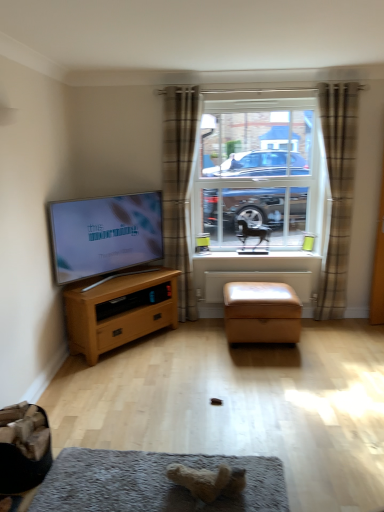
Where is `clear glass window at center`? The image size is (384, 512). clear glass window at center is located at coordinates (260, 170).

The image size is (384, 512). Find the location of `white painted wood at center`. white painted wood at center is located at coordinates (252, 252).

Measure the distance between white painted wood at center and camera.

white painted wood at center and camera are 4.01 meters apart.

What do you see at coordinates (252, 231) in the screenshot?
I see `black glossy horse at center, marked as the 2th animal in a left-to-right arrangement` at bounding box center [252, 231].

Locate an element on the screen. This screenshot has width=384, height=512. black glossy horse at center, which appears as the 1th animal when viewed from the back is located at coordinates (252, 231).

This screenshot has height=512, width=384. What do you see at coordinates (208, 481) in the screenshot?
I see `fuzzy beige teddy bear at lower center, positioned as the first animal in front-to-back order` at bounding box center [208, 481].

This screenshot has width=384, height=512. What are the coordinates of `clear glass window at center` in the screenshot? It's located at (260, 170).

Is matte black tv at left oriented towards soft gray carpet at lower center?

No, matte black tv at left is not facing towards soft gray carpet at lower center.

Considering the relative sizes of matte black tv at left and soft gray carpet at lower center in the image provided, is matte black tv at left bigger than soft gray carpet at lower center?

Yes, matte black tv at left is bigger than soft gray carpet at lower center.

How different are the orientations of matte black tv at left and soft gray carpet at lower center in degrees?

141 degrees separate the facing orientations of matte black tv at left and soft gray carpet at lower center.

Is point (149, 204) closer or farther from the camera than point (273, 488)?

Point (149, 204).

Considering the relative positions of clear glass window at center and wooden chest of drawers at left in the image provided, is clear glass window at center in front of wooden chest of drawers at left?

No, clear glass window at center is further to the viewer.

Is point (200, 122) farther from camera compared to point (141, 317)?

That is True.

Is wooden chest of drawers at left at the back of clear glass window at center?

No.

The height and width of the screenshot is (512, 384). I want to click on chest of drawers on the left of clear glass window at center, so click(x=120, y=311).

From a real-world perspective, is satin tan ottoman at center above or below plaid fabric curtain at center, the first curtain viewed from the left?

satin tan ottoman at center is situated lower than plaid fabric curtain at center, the first curtain viewed from the left, in the real world.

How distant is satin tan ottoman at center from plaid fabric curtain at center, the first curtain viewed from the left?

satin tan ottoman at center and plaid fabric curtain at center, the first curtain viewed from the left, are 93.65 centimeters apart from each other.

What's the angular difference between satin tan ottoman at center and plaid fabric curtain at center, the 2th curtain when ordered from right to left,'s facing directions?

satin tan ottoman at center and plaid fabric curtain at center, the 2th curtain when ordered from right to left, are facing 0.305 degrees away from each other.

Can you confirm if satin tan ottoman at center is taller than plaid fabric curtain at center, the first curtain viewed from the left?

In fact, satin tan ottoman at center may be shorter than plaid fabric curtain at center, the first curtain viewed from the left.

Could you measure the distance between brown plaid curtain at right, the first curtain when ordered from right to left, and white painted wood at center?

brown plaid curtain at right, the first curtain when ordered from right to left, is 30.14 inches from white painted wood at center.

Considering the relative positions of brown plaid curtain at right, the first curtain when ordered from right to left, and white painted wood at center in the image provided, is brown plaid curtain at right, the first curtain when ordered from right to left, to the left or to the right of white painted wood at center?

In the image, brown plaid curtain at right, the first curtain when ordered from right to left, appears on the right side of white painted wood at center.

From the image's perspective, who appears lower, brown plaid curtain at right, which is the 2th curtain from left to right, or white painted wood at center?

white painted wood at center is shown below in the image.

Can you confirm if brown plaid curtain at right, which is the 2th curtain from left to right, is shorter than white painted wood at center?

Incorrect, the height of brown plaid curtain at right, which is the 2th curtain from left to right, does not fall short of that of white painted wood at center.

From a real-world perspective, is brown plaid curtain at right, which is the 2th curtain from left to right, on top of satin tan ottoman at center?

Yes, from a real-world perspective, brown plaid curtain at right, which is the 2th curtain from left to right, is above satin tan ottoman at center.

From their relative heights in the image, would you say brown plaid curtain at right, the first curtain when ordered from right to left, is taller or shorter than satin tan ottoman at center?

In the image, brown plaid curtain at right, the first curtain when ordered from right to left, appears to be taller than satin tan ottoman at center.

Is satin tan ottoman at center completely or partially inside brown plaid curtain at right, the first curtain when ordered from right to left?

No, satin tan ottoman at center is not surrounded by brown plaid curtain at right, the first curtain when ordered from right to left.

Which object is thinner, brown plaid curtain at right, the first curtain when ordered from right to left, or satin tan ottoman at center?

brown plaid curtain at right, the first curtain when ordered from right to left, is thinner.

Does satin tan ottoman at center appear on the right side of white painted wood at center?

Incorrect, satin tan ottoman at center is not on the right side of white painted wood at center.

Which is less distant, (259, 284) or (293, 249)?

The point (259, 284) is closer to the camera.

From a real-world perspective, which is physically above, satin tan ottoman at center or white painted wood at center?

white painted wood at center.

Could white painted wood at center be considered to be inside satin tan ottoman at center?

No, white painted wood at center is not a part of satin tan ottoman at center.

The height and width of the screenshot is (512, 384). Identify the location of stool that is in front of the clear glass window at center. (261, 313).

Is satin tan ottoman at center facing towards clear glass window at center?

No, satin tan ottoman at center does not turn towards clear glass window at center.

Looking at this image, considering the relative sizes of satin tan ottoman at center and clear glass window at center in the image provided, is satin tan ottoman at center bigger than clear glass window at center?

Yes, satin tan ottoman at center is bigger than clear glass window at center.

Between satin tan ottoman at center and clear glass window at center, which one has less height?

With less height is satin tan ottoman at center.

You are a GUI agent. You are given a task and a screenshot of the screen. Output one action in this format:
    pyautogui.click(x=<x>, y=<y>)
    Task: Click on the dog bed in front of the matte black tv at left
    
    Given the screenshot: What is the action you would take?
    pyautogui.click(x=151, y=483)

I want to click on the chest of drawers below the clear glass window at center (from the image's perspective), so click(x=120, y=311).

Considering their positions, is white painted wood at center positioned further to black glossy horse at center, which appears as the 1th animal when viewed from the back, than clear glass window at center?

clear glass window at center is positioned further to the anchor black glossy horse at center, which appears as the 1th animal when viewed from the back.

Estimate the real-world distances between objects in this image. Which object is further from brown plaid curtain at right, which is the 2th curtain from left to right, satin tan ottoman at center or plaid fabric curtain at center, the 2th curtain when ordered from right to left?

plaid fabric curtain at center, the 2th curtain when ordered from right to left, lies further to brown plaid curtain at right, which is the 2th curtain from left to right, than the other object.

Looking at the image, which one is located closer to fuzzy beige teddy bear at lower center, the 1th animal when ordered from left to right, soft gray carpet at lower center or wooden chest of drawers at left?

The object closer to fuzzy beige teddy bear at lower center, the 1th animal when ordered from left to right, is soft gray carpet at lower center.

Based on their spatial positions, is clear glass window at center or plaid fabric curtain at center, the first curtain viewed from the left, closer to brown plaid curtain at right, the first curtain when ordered from right to left?

Based on the image, clear glass window at center appears to be nearer to brown plaid curtain at right, the first curtain when ordered from right to left.

Estimate the real-world distances between objects in this image. Which object is closer to fuzzy beige teddy bear at lower center, positioned as the 2th animal in top-to-bottom order, white painted wood at center or black glossy horse at center, which is the second animal from front to back?

The object closer to fuzzy beige teddy bear at lower center, positioned as the 2th animal in top-to-bottom order, is white painted wood at center.

Looking at the image, which one is located closer to white painted wood at center, matte black tv at left or black glossy horse at center, which appears as the 1th animal when viewed from the back?

black glossy horse at center, which appears as the 1th animal when viewed from the back.

Looking at the image, which one is located further to wooden chest of drawers at left, fuzzy beige teddy bear at lower center, the 1th animal when ordered from left to right, or black glossy horse at center, which appears as the first animal when viewed from the right?

fuzzy beige teddy bear at lower center, the 1th animal when ordered from left to right, lies further to wooden chest of drawers at left than the other object.

Estimate the real-world distances between objects in this image. Which object is further from clear glass window at center, matte black tv at left or brown plaid curtain at right, the first curtain when ordered from right to left?

matte black tv at left.

Locate an element on the screen. The width and height of the screenshot is (384, 512). dog bed between matte black tv at left and brown plaid curtain at right, which is the 2th curtain from left to right is located at coordinates (151, 483).

Identify the location of stool situated between wooden chest of drawers at left and white painted wood at center from left to right. The image size is (384, 512). (261, 313).

This screenshot has width=384, height=512. In order to click on animal between plaid fabric curtain at center, the 2th curtain when ordered from right to left, and satin tan ottoman at center from top to bottom in this screenshot , I will do `click(252, 231)`.

The width and height of the screenshot is (384, 512). In order to click on window situated between wooden chest of drawers at left and brown plaid curtain at right, the first curtain when ordered from right to left, from left to right in this screenshot , I will do `click(260, 170)`.